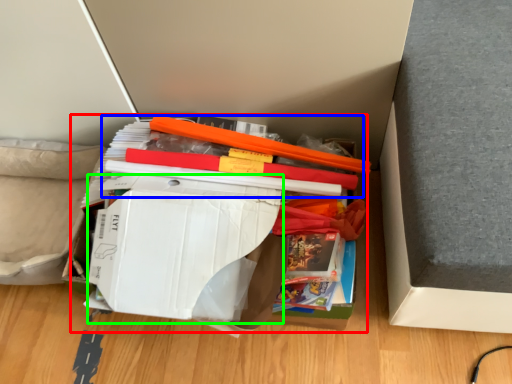
Question: Considering the real-world distances, which object is closest to paperback book (highlighted by a red box)? book (highlighted by a blue box) or paperback book (highlighted by a green box).

Choices:
 (A) book
 (B) paperback book

Answer: (B)